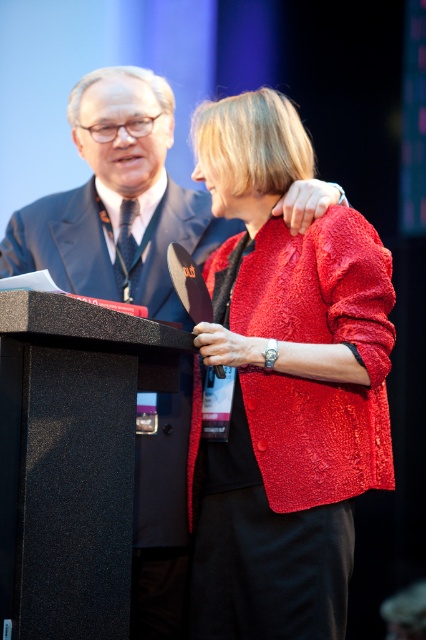
You are standing at the point marked as point [186,346] in the image. You want to take a photo of the podium with the black surface and the person in the red textured jacket. Is the distance from your current position to the camera sufficient to capture both subjects clearly in the frame?

The distance of point [186,346] from the camera is 5.36 feet. Since both the podium and the person in the red textured jacket are likely within this distance, they should be clearly visible in the photo taken from your current position.

You are an event organizer checking the stage setup. You notice the red textured jacket at center and the black textured podium at center. Which object is placed higher in the image?

The red textured jacket at center is positioned over the black textured podium at center, meaning it is higher.

You are an event organizer who needs to ensure all participants can see the podium and the speaker clearly. Given the red textured jacket at center and the black textured podium at center, which object is more likely to obstruct the view of the audience? Please explain your reasoning based on their sizes.

The red textured jacket at center is larger in size than the black textured podium at center, so it is more likely to obstruct the audience view.